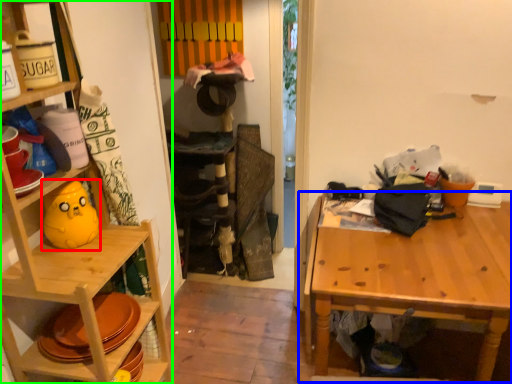
Question: Considering the real-world distances, which object is closest to toy (highlighted by a red box)? table (highlighted by a blue box) or shelf (highlighted by a green box).

Choices:
 (A) table
 (B) shelf

Answer: (B)